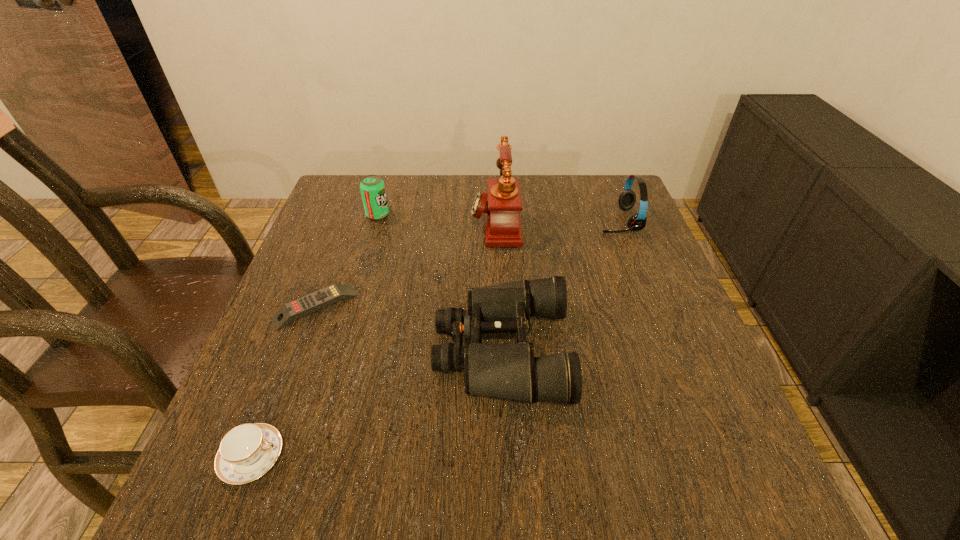
Image resolution: width=960 pixels, height=540 pixels. Identify the location of vacant space located 0.090m with the microphone attached to the side of the headset. (565, 220).

This screenshot has width=960, height=540. Identify the location of free point located with the microphone attached to the side of the headset. (457, 220).

Where is `vacant space located with the microphone attached to the side of the headset`? vacant space located with the microphone attached to the side of the headset is located at coordinates (461, 220).

In order to click on blank space located 0.130m on the front-facing side of the pop soda in this screenshot , I will do `click(437, 215)`.

Locate an element on the screen. The image size is (960, 540). vacant area situated through the eyepieces of the third shortest object is located at coordinates (383, 349).

The image size is (960, 540). I want to click on free space located through the eyepieces of the third shortest object, so click(373, 349).

Where is `vacant space situated 0.340m through the eyepieces of the third shortest object`? This screenshot has height=540, width=960. vacant space situated 0.340m through the eyepieces of the third shortest object is located at coordinates (261, 349).

In order to click on free region located on the side with the handle of the teacup in this screenshot , I will do `click(327, 457)`.

Image resolution: width=960 pixels, height=540 pixels. Find the location of `vacant space positioned on the right of the remote control`. vacant space positioned on the right of the remote control is located at coordinates (521, 307).

Where is `telephone located in the far edge section of the desktop`? The width and height of the screenshot is (960, 540). telephone located in the far edge section of the desktop is located at coordinates (503, 228).